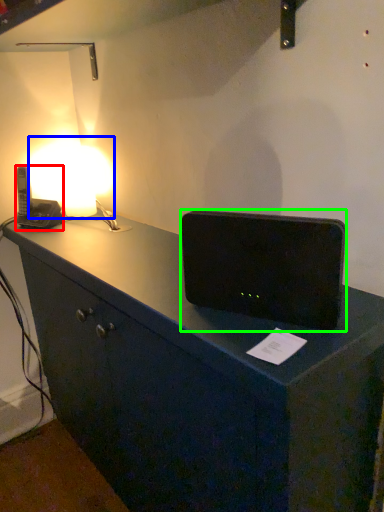
Question: Considering the real-world distances, which object is farthest from gadget (highlighted by a red box)? lamp (highlighted by a blue box) or loudspeaker (highlighted by a green box)?

Choices:
 (A) lamp
 (B) loudspeaker

Answer: (B)